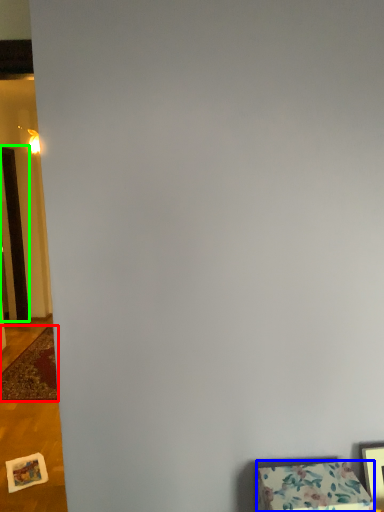
Question: Which object is the closest to the mat (highlighted by a red box)? Choose among these: furniture (highlighted by a blue box) or door (highlighted by a green box).

Choices:
 (A) furniture
 (B) door

Answer: (B)